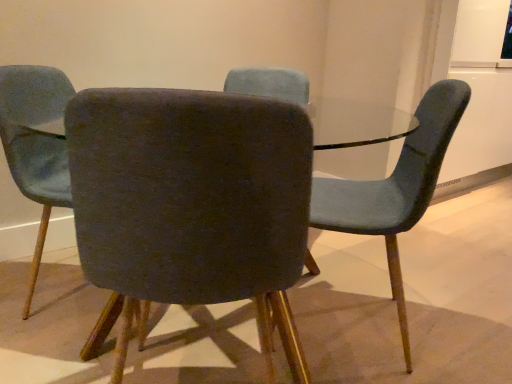
Question: Should I look upward or downward to see velvet dark gray chair at center, which appears as the third chair when viewed from the right?

Choices:
 (A) up
 (B) down

Answer: (A)

Question: Is velvet dark gray chair at center, the second chair from the left, outside velvet dark gray chair at center, which appears as the third chair when viewed from the right?

Choices:
 (A) yes
 (B) no

Answer: (A)

Question: Can you confirm if velvet dark gray chair at center, acting as the 2th chair starting from the right, is shorter than velvet dark gray chair at center, marked as the 1th chair in a left-to-right arrangement?

Choices:
 (A) no
 (B) yes

Answer: (B)

Question: Is velvet dark gray chair at center, the second chair from the left, at the left side of velvet dark gray chair at center, which appears as the third chair when viewed from the right?

Choices:
 (A) yes
 (B) no

Answer: (B)

Question: Can you confirm if velvet dark gray chair at center, the second chair from the left, is smaller than velvet dark gray chair at center, which appears as the third chair when viewed from the right?

Choices:
 (A) no
 (B) yes

Answer: (A)

Question: Is velvet dark gray chair at center, acting as the 2th chair starting from the right, behind velvet dark gray chair at center, marked as the 1th chair in a left-to-right arrangement?

Choices:
 (A) yes
 (B) no

Answer: (B)

Question: Does velvet dark gray chair at center, acting as the 2th chair starting from the right, have a greater height compared to velvet dark gray chair at center, marked as the 1th chair in a left-to-right arrangement?

Choices:
 (A) no
 (B) yes

Answer: (A)

Question: Does velvet teal chair at right, acting as the 1th chair starting from the right, touch velvet dark gray chair at center, the second chair from the left?

Choices:
 (A) no
 (B) yes

Answer: (A)

Question: Is velvet teal chair at right, the third chair from the left, not inside velvet dark gray chair at center, acting as the 2th chair starting from the right?

Choices:
 (A) yes
 (B) no

Answer: (A)

Question: Can you confirm if velvet teal chair at right, acting as the 1th chair starting from the right, is positioned to the right of velvet dark gray chair at center, acting as the 2th chair starting from the right?

Choices:
 (A) yes
 (B) no

Answer: (A)

Question: Is velvet dark gray chair at center, the second chair from the left, a part of velvet teal chair at right, acting as the 1th chair starting from the right?

Choices:
 (A) no
 (B) yes

Answer: (A)

Question: Considering the relative sizes of velvet teal chair at right, the third chair from the left, and velvet dark gray chair at center, acting as the 2th chair starting from the right, in the image provided, is velvet teal chair at right, the third chair from the left, taller than velvet dark gray chair at center, acting as the 2th chair starting from the right,?

Choices:
 (A) no
 (B) yes

Answer: (A)

Question: Is velvet dark gray chair at center, marked as the 1th chair in a left-to-right arrangement, located outside velvet dark gray chair at center, the second chair from the left?

Choices:
 (A) yes
 (B) no

Answer: (A)